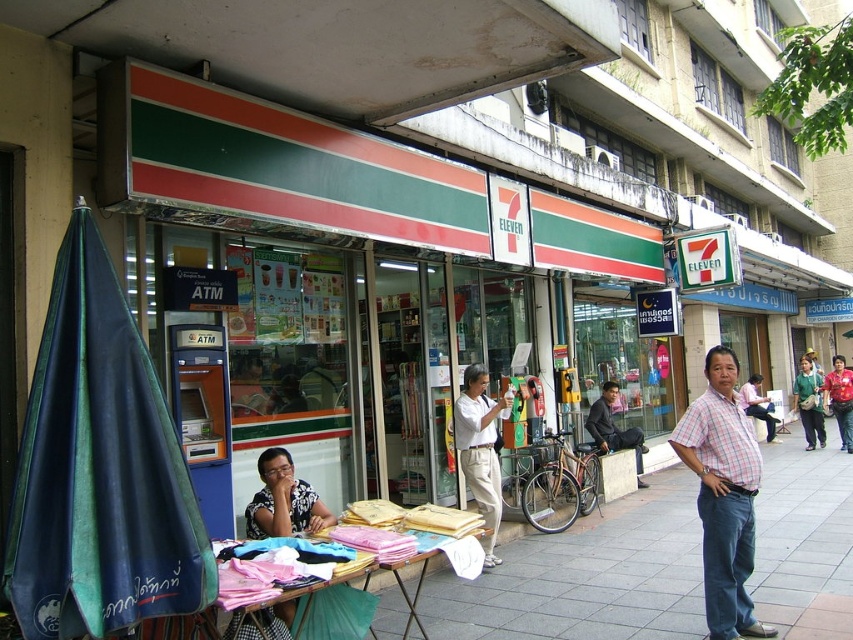
Question: Which point is farther to the camera?

Choices:
 (A) dark gray pants at center
 (B) plaid shirt at center
 (C) green fabric bag at lower right
 (D) patterned fabric at center

Answer: (C)

Question: Which point is farther from the camera taking this photo?

Choices:
 (A) (801, 417)
 (B) (589, 428)
 (C) (122, 570)

Answer: (A)

Question: Considering the real-world distances, which object is closest to the blue fabric umbrella at left?

Choices:
 (A) green fabric bag at lower right
 (B) dark gray pants at center

Answer: (B)

Question: Is plaid shirt at center wider than white matte shirt at center?

Choices:
 (A) no
 (B) yes

Answer: (B)

Question: Can you confirm if white matte shirt at center is positioned to the left of dark gray pants at center?

Choices:
 (A) no
 (B) yes

Answer: (B)

Question: In this image, where is blue fabric umbrella at left located relative to dark gray pants at center?

Choices:
 (A) right
 (B) left

Answer: (B)